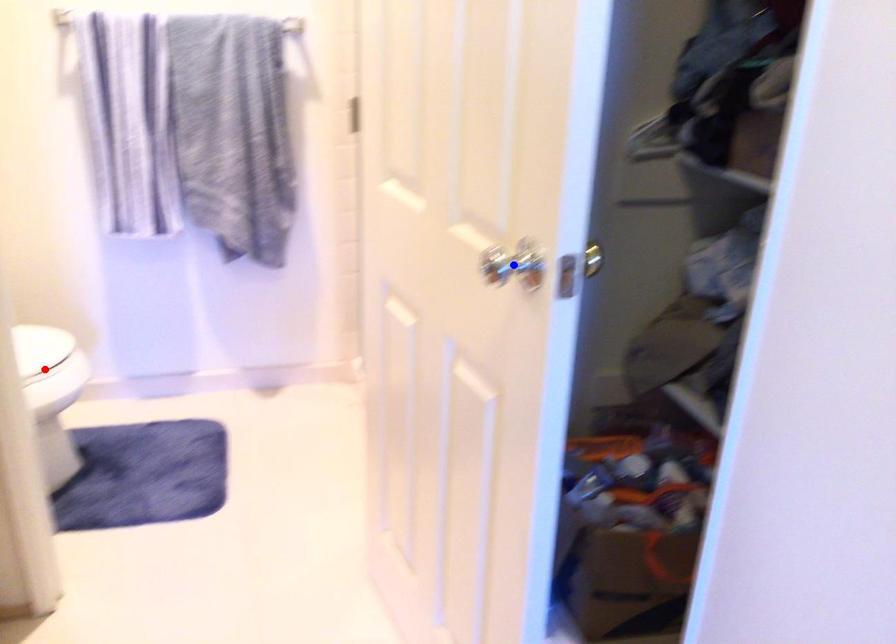
Question: Which of the two points in the image is closer to the camera?

Choices:
 (A) Blue point is closer.
 (B) Red point is closer.

Answer: (A)